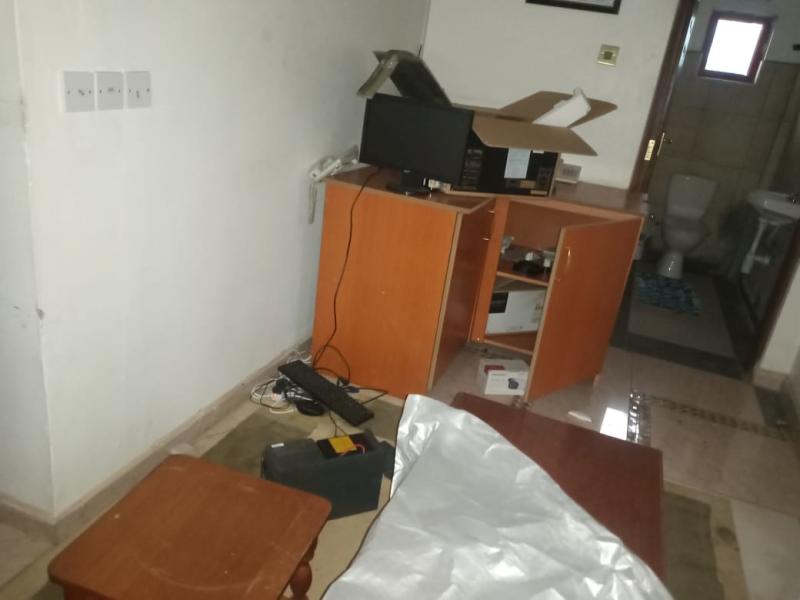
Where is `toilet`? toilet is located at coordinates (674, 225).